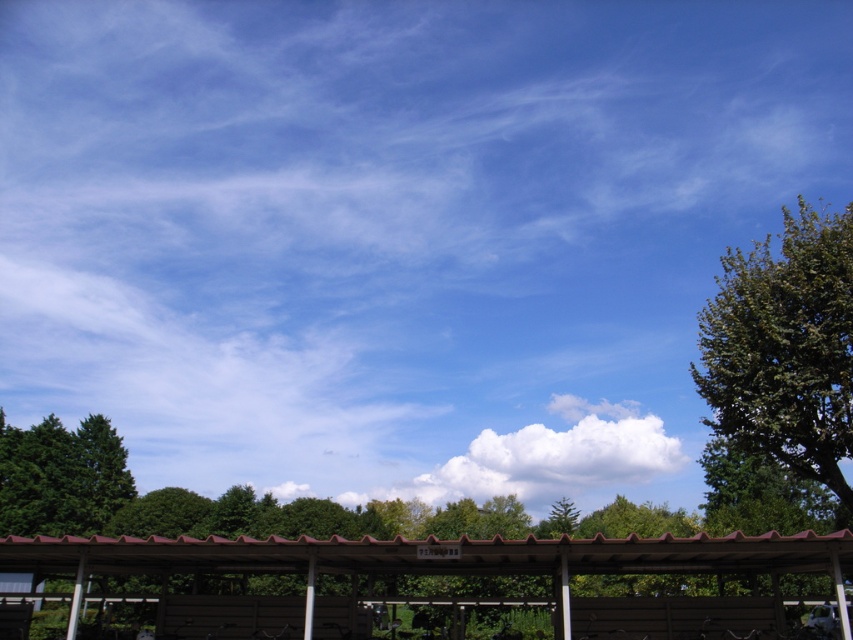
You are planning to take a photo of the brown corrugated metal shelter at center and the green leafy tree at right. Which object should you focus on first if you want to capture both in a single frame without moving the camera?

The green leafy tree at right is larger in size than the brown corrugated metal shelter at center, so you should focus on the brown corrugated metal shelter at center first to ensure it is in frame before adjusting for the larger tree.

You are standing in the outdoor scene and want to know if the green leafy tree at right is positioned higher than the white fluffy cloud at center. Can you determine this based on the scene?

The green leafy tree at right is above the white fluffy cloud at center, so yes, it is positioned higher.